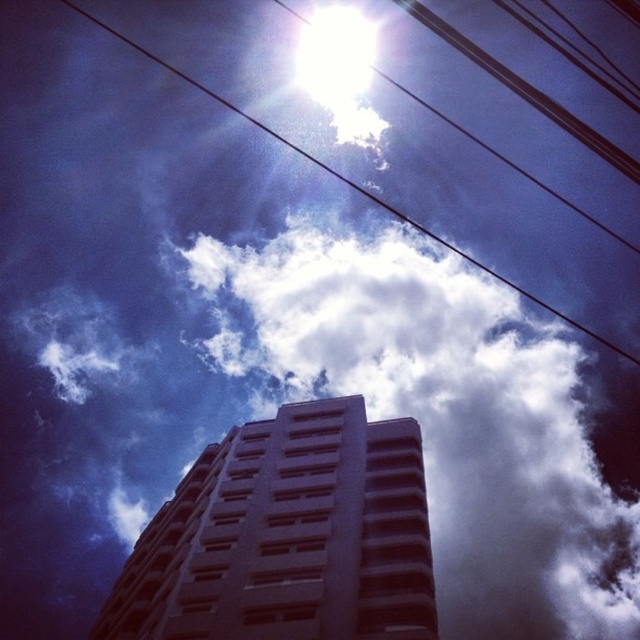
Is white fluffy cloud at upper center wider than smooth concrete building at center?

Yes, white fluffy cloud at upper center is wider than smooth concrete building at center.

Can you confirm if white fluffy cloud at upper center is shorter than smooth concrete building at center?

In fact, white fluffy cloud at upper center may be taller than smooth concrete building at center.

You are a GUI agent. You are given a task and a screenshot of the screen. Output one action in this format:
    pyautogui.click(x=<x>, y=<y>)
    Task: Click on the white fluffy cloud at upper center
    The width and height of the screenshot is (640, 640).
    Given the screenshot: What is the action you would take?
    pyautogui.click(x=442, y=413)

Does white fluffy cloud at upper center have a lesser width compared to metallic wire at upper center?

Yes, white fluffy cloud at upper center is thinner than metallic wire at upper center.

Measure the distance between white fluffy cloud at upper center and camera.

white fluffy cloud at upper center and camera are 249.86 meters apart from each other.

At what (x,y) coordinates should I click in order to perform the action: click on white fluffy cloud at upper center. Please return your answer as a coordinate pair (x, y). Looking at the image, I should click on (x=442, y=413).

Which is below, smooth concrete building at center or metallic wire at upper center?

smooth concrete building at center is lower down.

Is point (154, 614) in front of point (550, 307)?

Yes.

Does point (410, 538) come closer to viewer compared to point (376, 196)?

That is True.

At what (x,y) coordinates should I click in order to perform the action: click on smooth concrete building at center. Please return your answer as a coordinate pair (x, y). The width and height of the screenshot is (640, 640). Looking at the image, I should click on (288, 536).